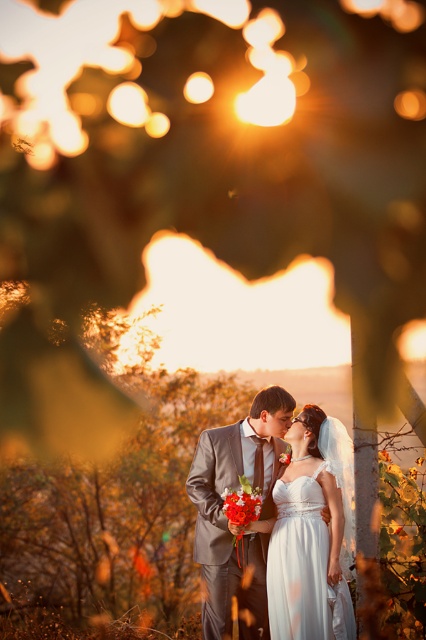
Who is higher up, matte gray suit at center or white satin dress at center?

Positioned higher is matte gray suit at center.

Based on the photo, does matte gray suit at center have a greater width compared to white satin dress at center?

Yes.

Identify the location of matte gray suit at center. The height and width of the screenshot is (640, 426). (226, 516).